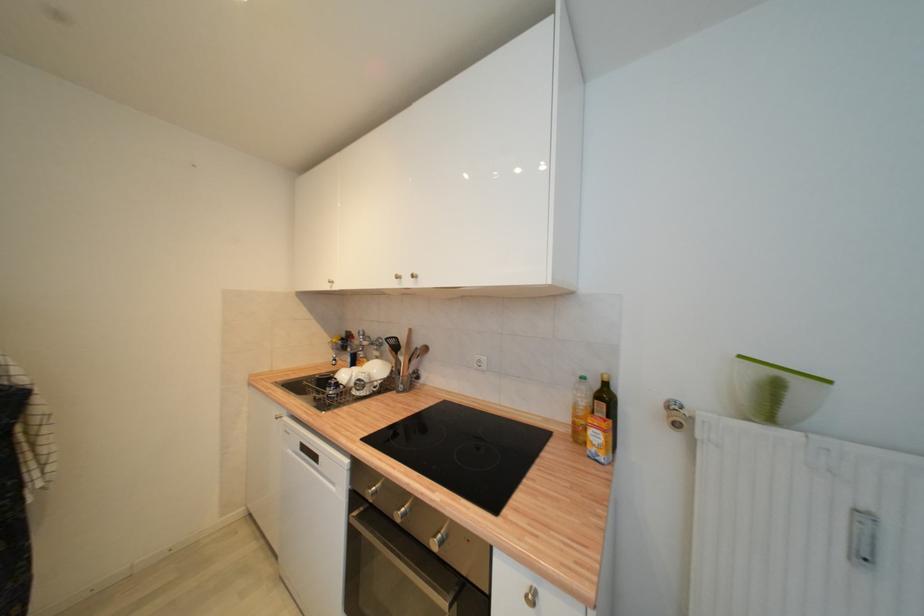
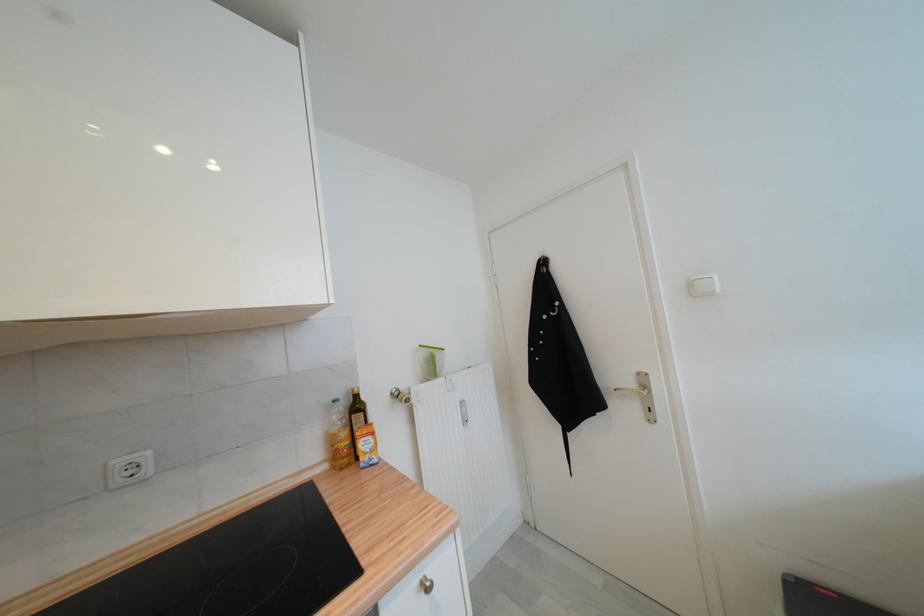
Locate, in the second image, the point that corresponds to point 746,359 in the first image.

(426, 347)